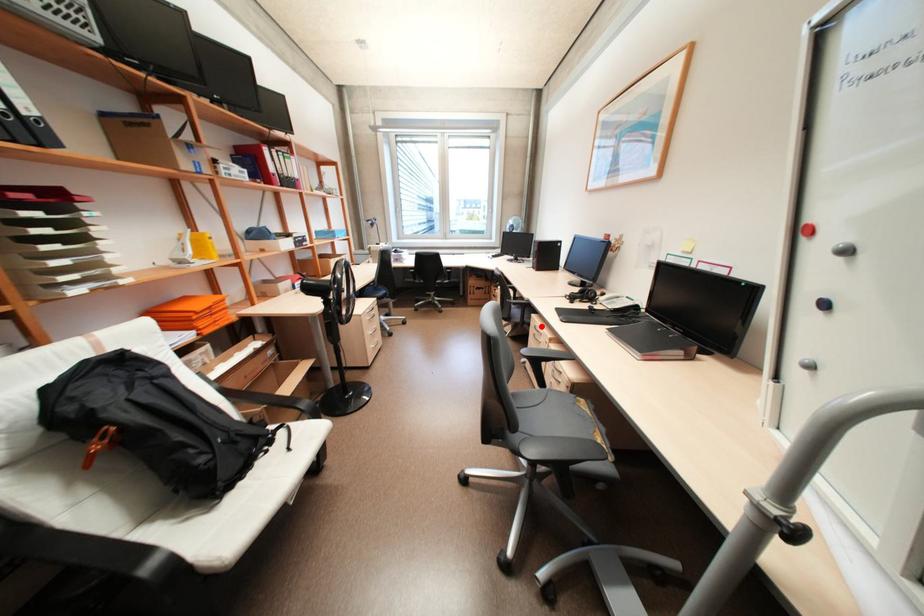
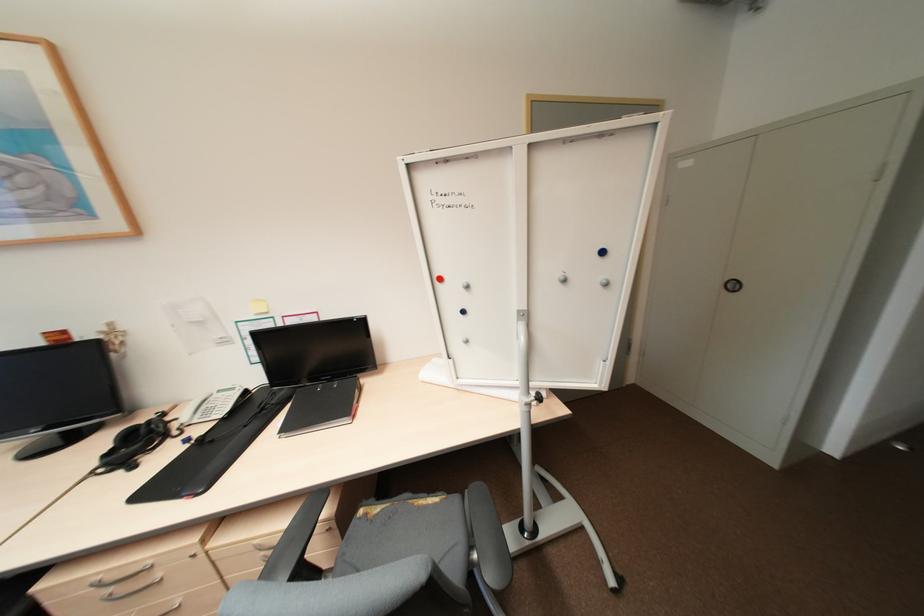
Locate, in the second image, the point that corresponds to the highlighted location in the first image.

(104, 584)